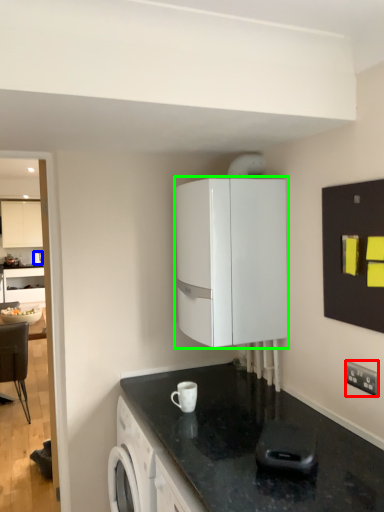
Question: Which is farther away from electric outlet (highlighted by a red box)? kitchen appliance (highlighted by a blue box) or cabinetry (highlighted by a green box)?

Choices:
 (A) kitchen appliance
 (B) cabinetry

Answer: (A)